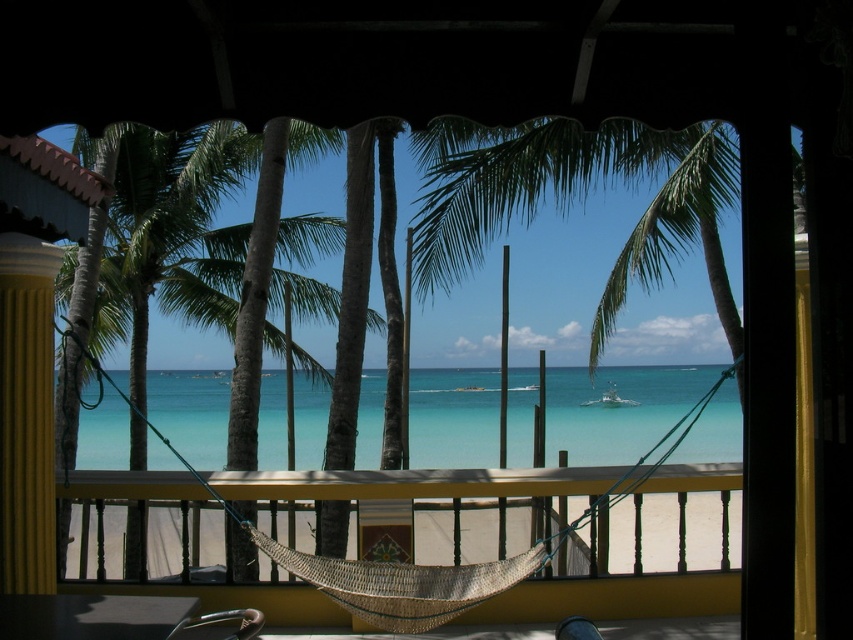
What is the color of the water at the point marked by coordinates (618, 410) in the scene?

The point marked by coordinates (618, 410) corresponds to clear blue water at center.

You are standing on the balcony and want to lie down in the woven rope hammock at center. To do so, you need to step over the clear blue water at center. Is this possible?

The woven rope hammock at center is behind the clear blue water at center, so you cannot step over the clear blue water at center to reach it because the hammock is positioned further back from your view.